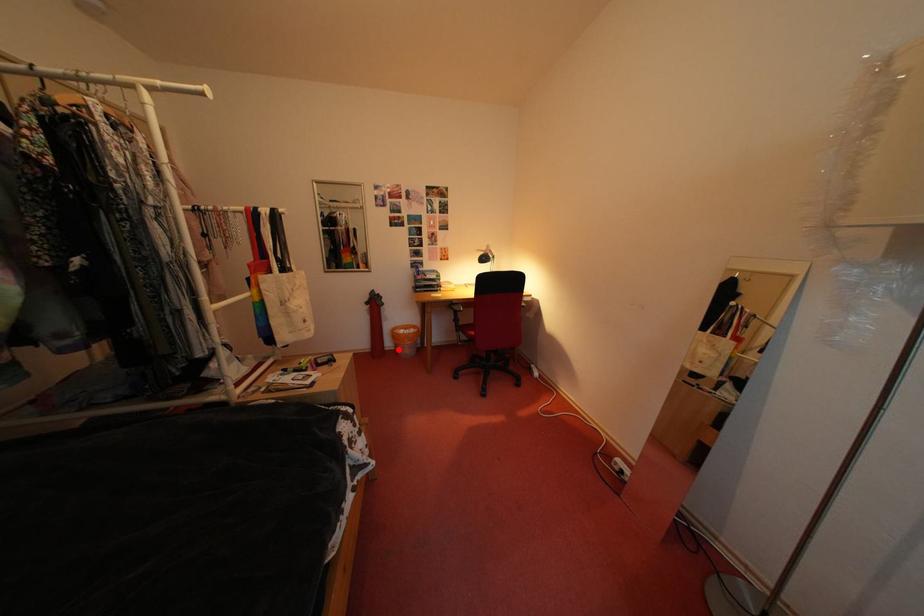
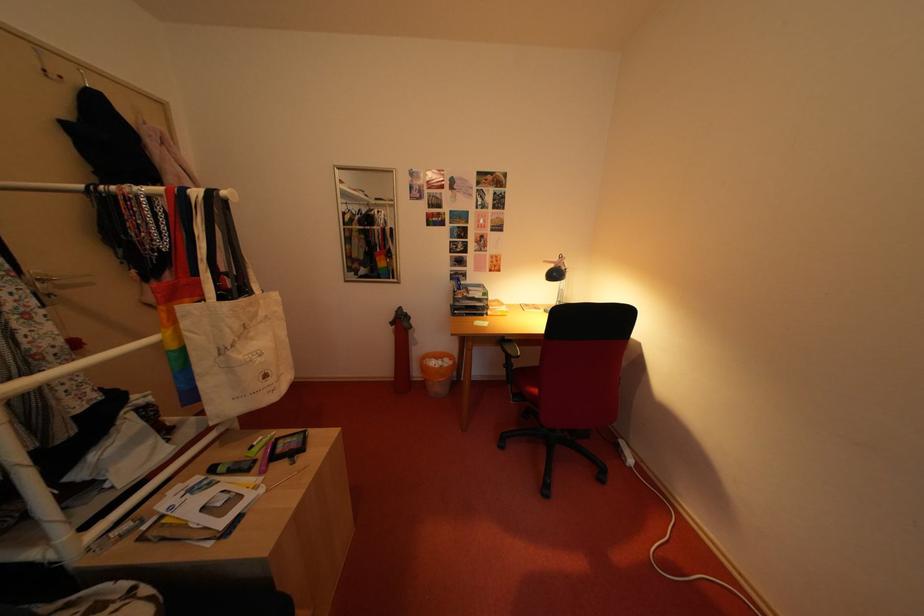
Locate, in the second image, the point that corresponds to the highlighted location in the first image.

(427, 379)